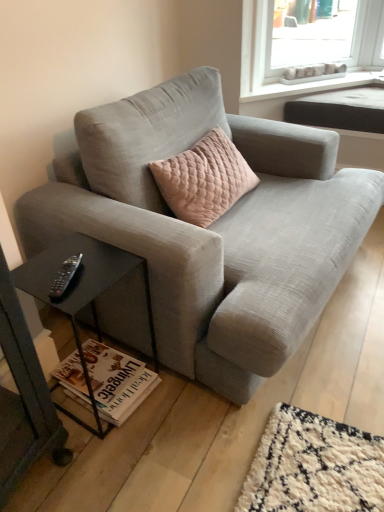
Find the location of a particular element. vacant location behind white paper magazine at lower left is located at coordinates [x=89, y=338].